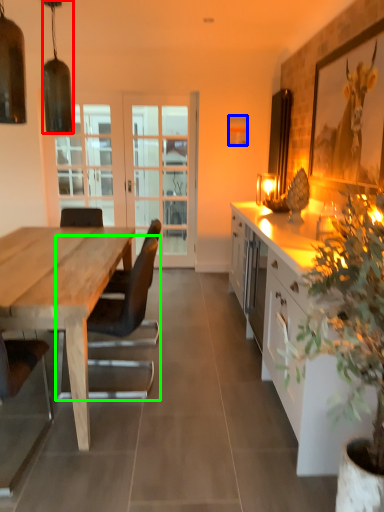
Question: Which object is positioned closest to lamp (highlighted by a red box)? Select from picture frame (highlighted by a blue box) and chair (highlighted by a green box).

Choices:
 (A) picture frame
 (B) chair

Answer: (A)